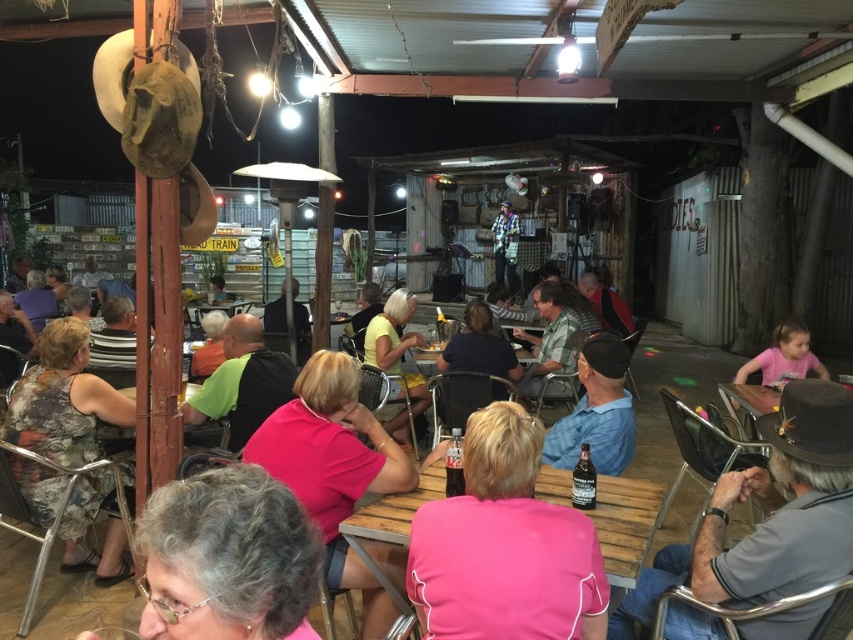
You are a photographer at the event and want to capture both the green matte shirt at center and the flannel shirt at center in the same frame. Which shirt should you position your camera closer to in order to include both in the shot?

→ You should position your camera closer to the green matte shirt at center because it is on the left side of the flannel shirt at center, allowing both to be captured within the frame when centered appropriately.

You are a photographer at the event and want to capture both the printed fabric dress at lower left and the pink matte shirt at lower right in the same frame. Which one is positioned lower in the image?

The printed fabric dress at lower left is positioned below the pink matte shirt at lower right, so it is lower in the image.